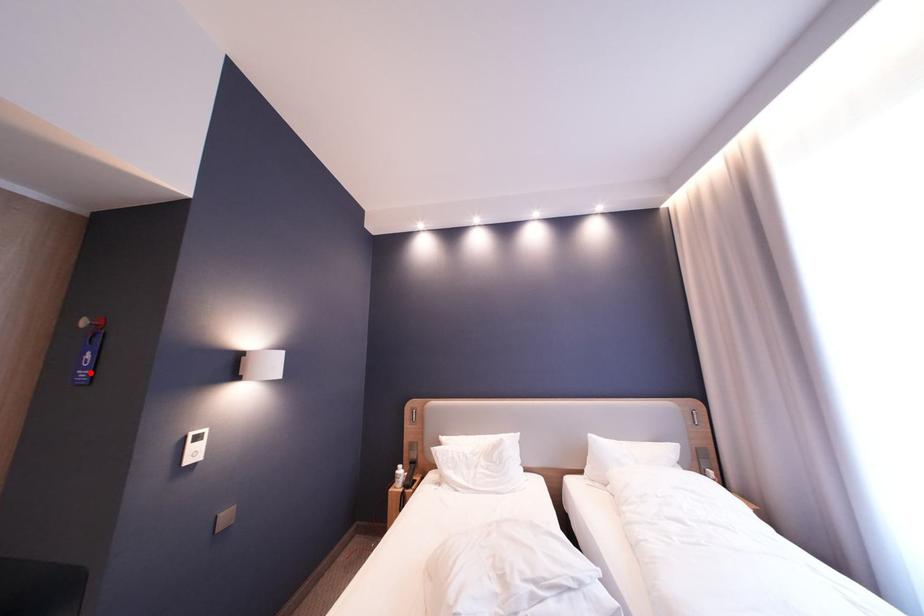
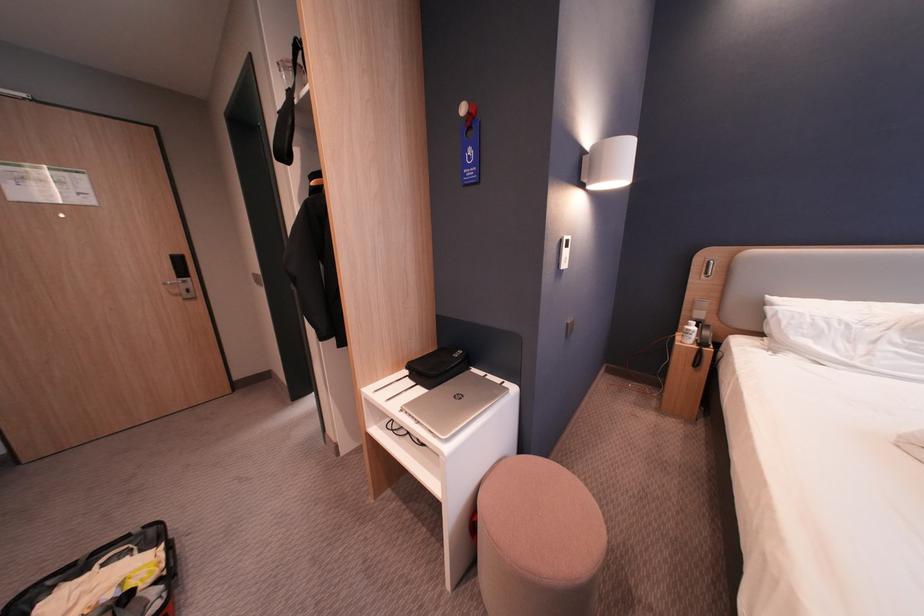
In the second image, find the point that corresponds to the highlighted location in the first image.

(477, 172)